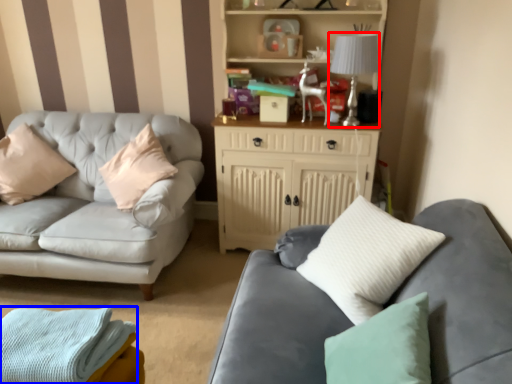
Question: Which of the following is the closest to the observer, lamp (highlighted by a red box) or material (highlighted by a blue box)?

Choices:
 (A) lamp
 (B) material

Answer: (B)